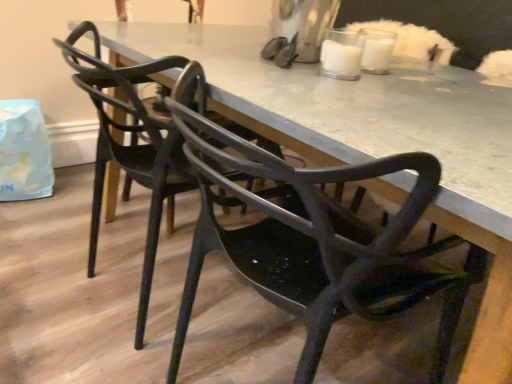
Question: From the image's perspective, is matte black chair at center, acting as the 2th chair starting from the front, positioned above or below matte black table at center?

Choices:
 (A) above
 (B) below

Answer: (A)

Question: Considering their positions, is matte black chair at center, acting as the 2th chair starting from the front, located in front of or behind matte black table at center?

Choices:
 (A) front
 (B) behind

Answer: (B)

Question: Estimate the real-world distances between objects in this image. Which object is farther from the matte black chair at center, arranged as the 2th chair when viewed from the back?

Choices:
 (A) matte black table at center
 (B) matte black chair at center, acting as the 2th chair starting from the front

Answer: (B)

Question: Which is farther from the matte black chair at center, which is counted as the 1th chair, starting from the front?

Choices:
 (A) matte black chair at center, acting as the 2th chair starting from the front
 (B) matte black table at center

Answer: (A)